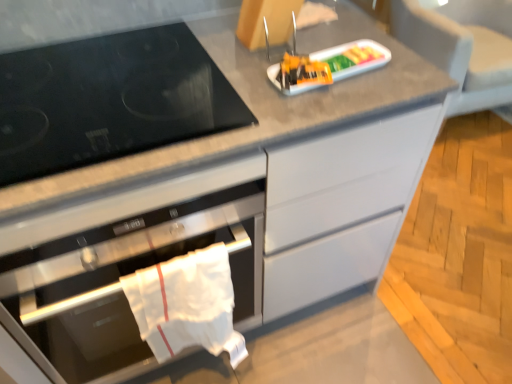
Question: Based on their positions, is gray fabric armchair at upper right located to the left or right of stainless steel oven at center?

Choices:
 (A) left
 (B) right

Answer: (B)

Question: From the image's perspective, is gray fabric armchair at upper right located above or below stainless steel oven at center?

Choices:
 (A) above
 (B) below

Answer: (A)

Question: Considering the real-world distances, which object is closest to the stainless steel oven at center?

Choices:
 (A) black glass gas stove at left
 (B) white cloth towel at lower left
 (C) plastic tray at center
 (D) gray fabric armchair at upper right

Answer: (B)

Question: Which of these objects is positioned closest to the black glass gas stove at left?

Choices:
 (A) plastic tray at center
 (B) white cloth towel at lower left
 (C) gray fabric armchair at upper right
 (D) stainless steel oven at center

Answer: (D)